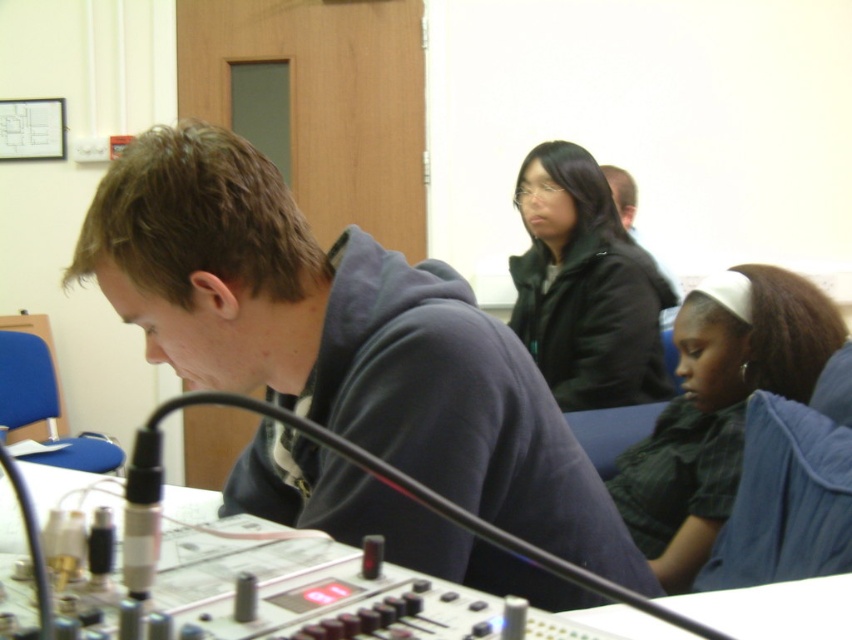
Question: Which of these objects is positioned farthest from the matte black jacket at center?

Choices:
 (A) dark green fabric shirt at lower right
 (B) matte black jacket at upper center

Answer: (A)

Question: Is dark green fabric shirt at lower right above matte black jacket at upper center?

Choices:
 (A) no
 (B) yes

Answer: (A)

Question: Which of the following is the farthest from the observer?

Choices:
 (A) dark green fabric shirt at lower right
 (B) matte black jacket at center
 (C) matte black jacket at upper center

Answer: (C)

Question: Is matte black jacket at center smaller than matte black jacket at upper center?

Choices:
 (A) yes
 (B) no

Answer: (B)

Question: Is dark green fabric shirt at lower right above matte black jacket at upper center?

Choices:
 (A) yes
 (B) no

Answer: (B)

Question: Which point is closer to the camera taking this photo?

Choices:
 (A) (651, 253)
 (B) (614, 269)

Answer: (B)